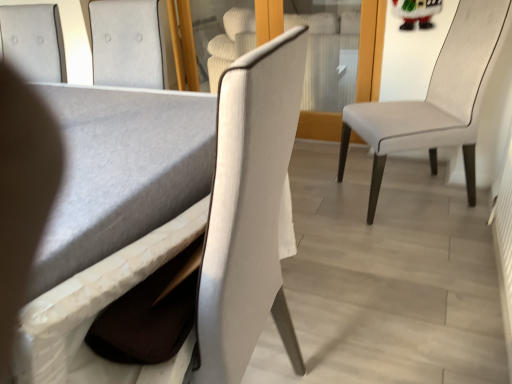
Question: Is white leather chair at right, which is counted as the 3th chair, starting from the left, oriented towards transparent glass door at center?

Choices:
 (A) yes
 (B) no

Answer: (B)

Question: Is white leather chair at right, which is counted as the 3th chair, starting from the left, in contact with transparent glass door at center?

Choices:
 (A) yes
 (B) no

Answer: (B)

Question: Is white leather chair at right, placed as the 1th chair when sorted from right to left, at the right side of transparent glass door at center?

Choices:
 (A) no
 (B) yes

Answer: (B)

Question: Is white leather chair at right, which is counted as the 3th chair, starting from the left, shorter than transparent glass door at center?

Choices:
 (A) no
 (B) yes

Answer: (A)

Question: Is the depth of white leather chair at right, placed as the 1th chair when sorted from right to left, less than that of transparent glass door at center?

Choices:
 (A) no
 (B) yes

Answer: (B)

Question: From a real-world perspective, is matte gray table at lower left above or below transparent glass door at center?

Choices:
 (A) below
 (B) above

Answer: (B)

Question: From the image's perspective, relative to transparent glass door at center, is matte gray table at lower left above or below?

Choices:
 (A) below
 (B) above

Answer: (A)

Question: In terms of height, does matte gray table at lower left look taller or shorter compared to transparent glass door at center?

Choices:
 (A) tall
 (B) short

Answer: (A)

Question: Is matte gray table at lower left wider or thinner than transparent glass door at center?

Choices:
 (A) wide
 (B) thin

Answer: (B)

Question: Do you think matte gray table at lower left is within white leather chair at right, which is counted as the 3th chair, starting from the left, or outside of it?

Choices:
 (A) outside
 (B) inside

Answer: (A)

Question: From the image's perspective, is matte gray table at lower left above or below white leather chair at right, which is counted as the 3th chair, starting from the left?

Choices:
 (A) above
 (B) below

Answer: (B)

Question: Would you say matte gray table at lower left is to the left or to the right of white leather chair at right, placed as the 1th chair when sorted from right to left, in the picture?

Choices:
 (A) left
 (B) right

Answer: (A)

Question: Is point (199, 117) closer or farther from the camera than point (449, 142)?

Choices:
 (A) closer
 (B) farther

Answer: (A)

Question: In terms of width, does matte white chair at center, which ranks as the 2th chair in left-to-right order, look wider or thinner when compared to matte gray table at lower left?

Choices:
 (A) wide
 (B) thin

Answer: (B)

Question: In terms of size, does matte white chair at center, which ranks as the 2th chair in left-to-right order, appear bigger or smaller than matte gray table at lower left?

Choices:
 (A) big
 (B) small

Answer: (B)